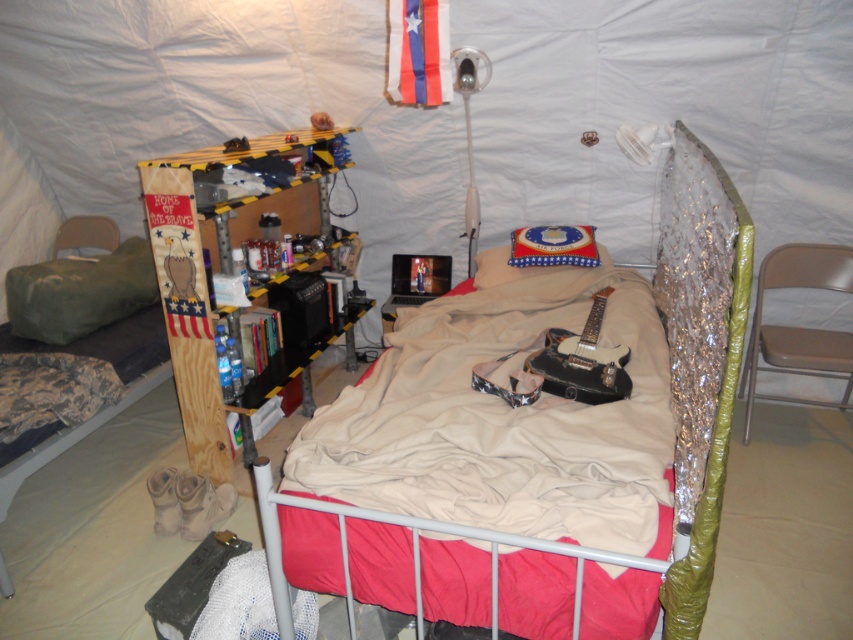
Does point (704, 150) come in front of point (50, 323)?

Yes.

Where is `metallic silver bed at center`? The image size is (853, 640). metallic silver bed at center is located at coordinates (688, 397).

Locate an element on the screen. metallic silver bed at center is located at coordinates (688, 397).